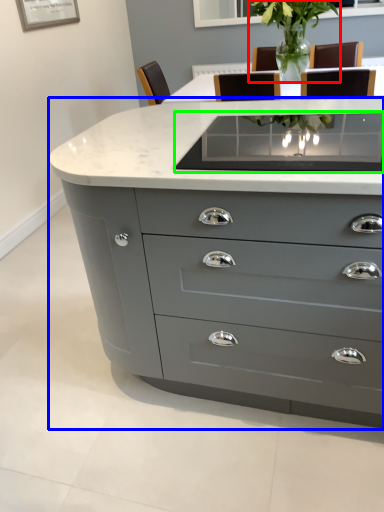
Question: Which is nearer to the plant (highlighted by a red box)? chest of drawers (highlighted by a blue box) or glass table (highlighted by a green box).

Choices:
 (A) chest of drawers
 (B) glass table

Answer: (B)